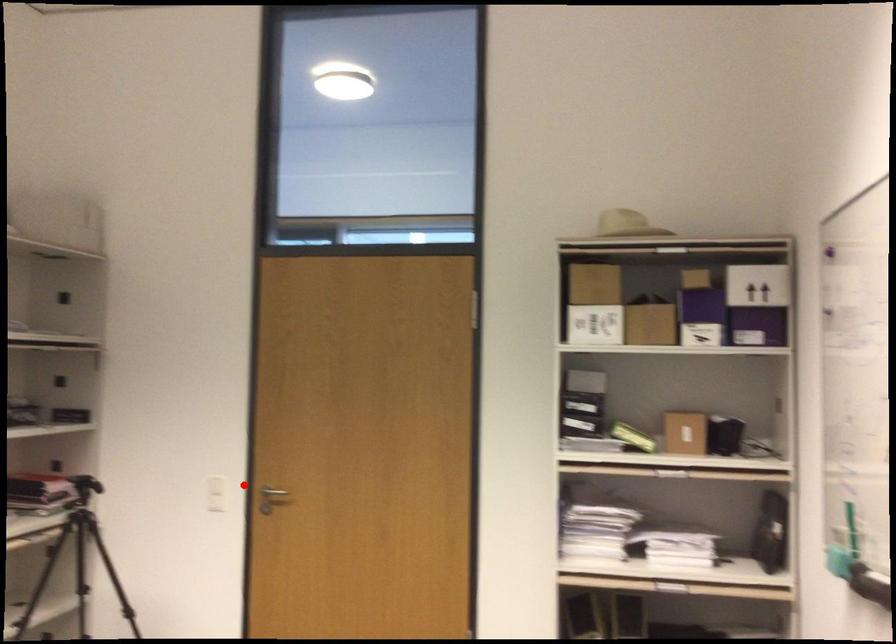
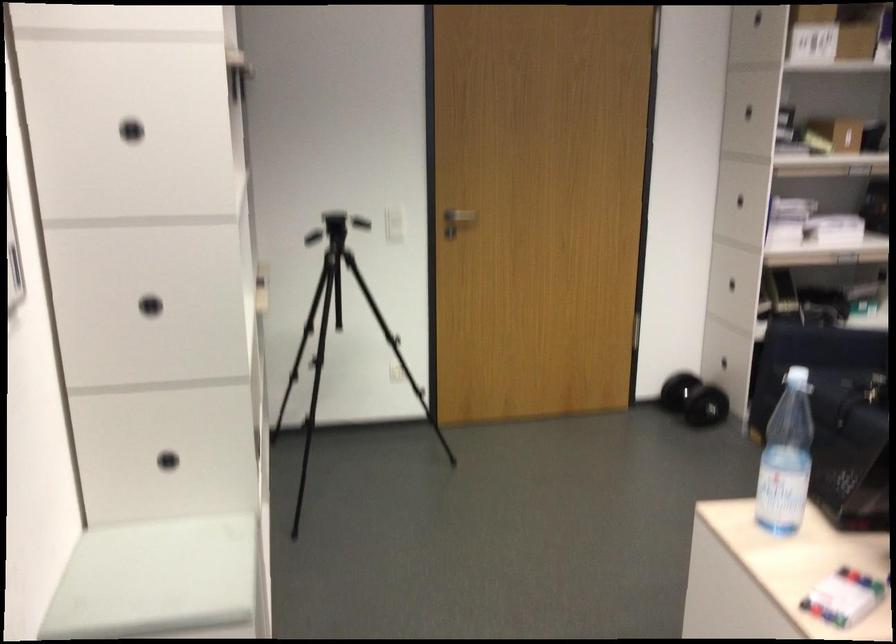
Find the pixel in the second image that matches the highlighted location in the first image.

(393, 214)